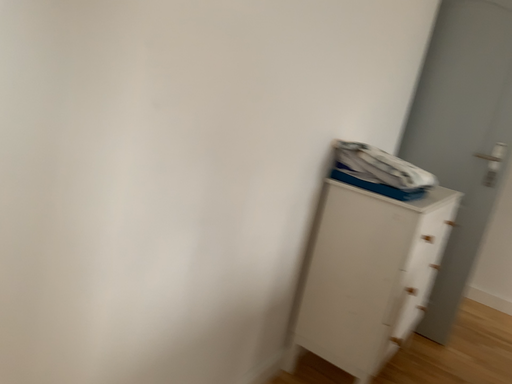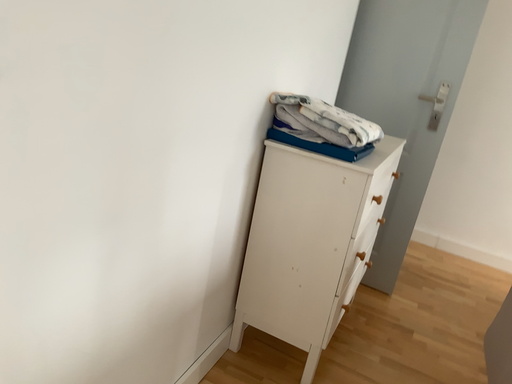
Question: Which way did the camera rotate in the video?

Choices:
 (A) rotated upward
 (B) rotated downward

Answer: (B)